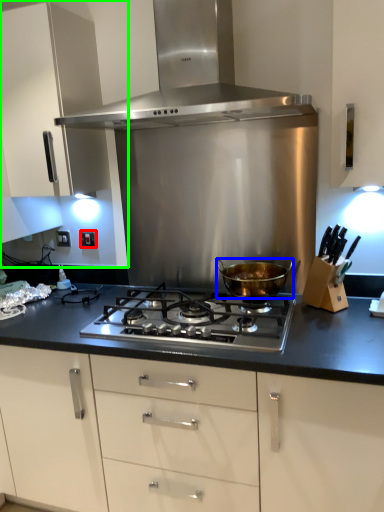
Question: Which object is the closest to the electric outlet (highlighted by a red box)? Choose among these: kitchen appliance (highlighted by a blue box) or cabinetry (highlighted by a green box).

Choices:
 (A) kitchen appliance
 (B) cabinetry

Answer: (B)